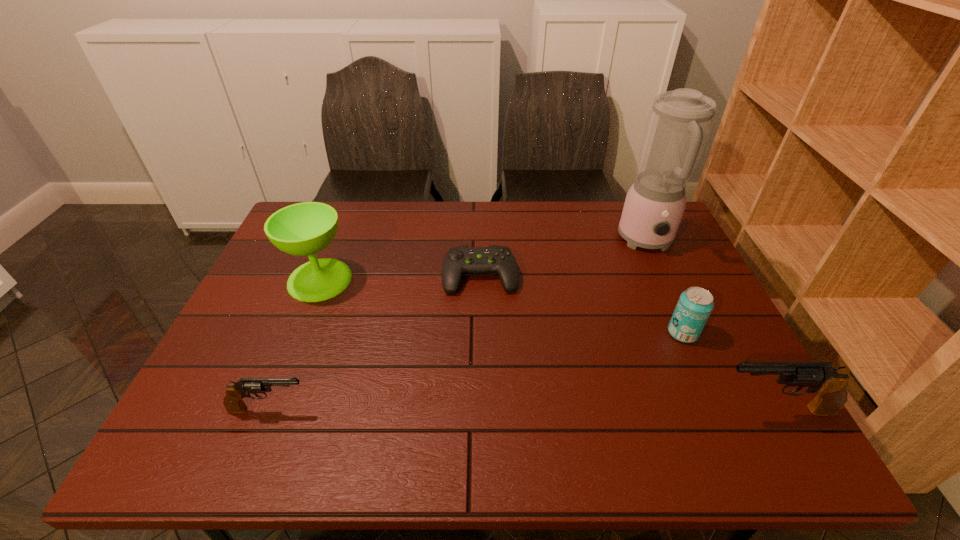
Locate an element on the screen. the shorter gun is located at coordinates (233, 402).

Locate an element on the screen. the left gun is located at coordinates (233, 402).

Identify the location of the right gun. (831, 386).

Identify the location of the taller gun. The image size is (960, 540). (831, 386).

The width and height of the screenshot is (960, 540). What are the coordinates of `the tallest object` in the screenshot? It's located at (679, 122).

What are the coordinates of `wineglass` in the screenshot? It's located at (303, 229).

Identify the location of the shortest object. (460, 260).

Find the location of `control`. control is located at coordinates (460, 260).

This screenshot has width=960, height=540. I want to click on the fourth farthest object, so click(695, 305).

I want to click on vacant position located along the barrel of the fifth tallest object, so click(366, 409).